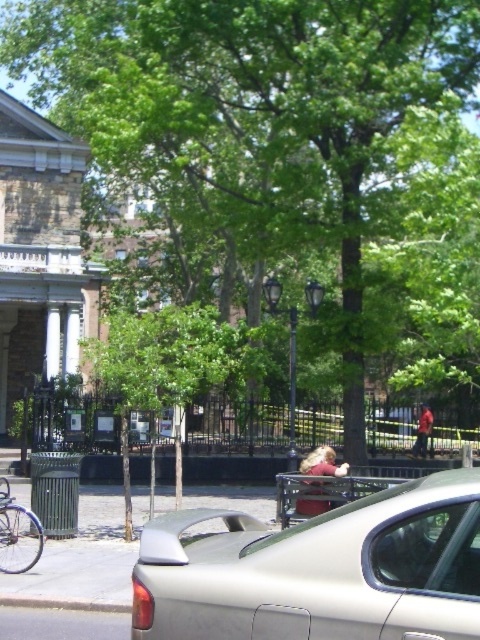
You are standing in the urban park scene and want to place a small flag at each of the two points, point (415, 522) and point (43, 544). Which point will have its flag appear closer to you when viewed from your current position?

The flag placed at point (415, 522) will appear closer to you because it is physically closer to the viewer compared to point (43, 544), as stated in the description.

You are a delivery person who needs to park your silver metallic bicycle at lower left near the gray concrete curb at lower left. Based on the scene, will the bicycle fit vertically next to the curb without tilting it?

The silver metallic bicycle at lower left is much taller than the gray concrete curb at lower left, so it will not fit vertically next to the curb without tilting it.

You are standing at the point with coordinates (320, 570) in the urban park scene. What object is exactly at your current location?

The silver metallic car at center is located at point (320, 570).